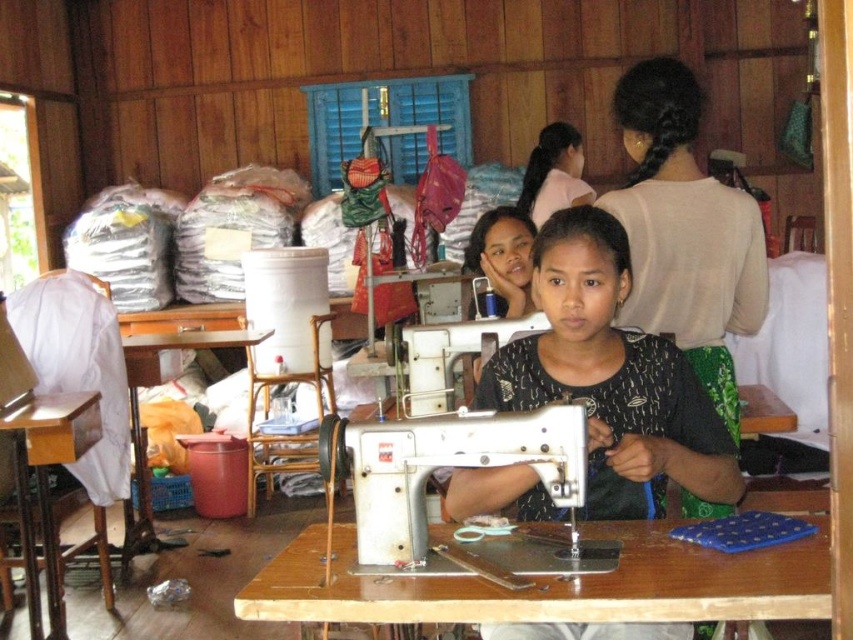
Based on the photo, you are a tailor trying to place a new sewing machine on the wooden table at lower left. The sewing machine you have is as wide as the black matte shirt at center. Will the sewing machine fit on the table?

The black matte shirt at center is narrower than the wooden table at lower left, so the sewing machine, being the same width as the shirt, will fit on the table.

You are a tailor trying to organize your sewing workshop. You have a black matte shirt at center and a wooden desk at lower left. Which object is shorter?

The black matte shirt at center is shorter than the wooden desk at lower left.

You are a visitor in the sewing workshop and want to know the relative positions of the brown wooden table at center and the light pink fabric at upper center. From your perspective, which object is closer to you?

The brown wooden table at center is closer to you because it is in front of the light pink fabric at upper center.